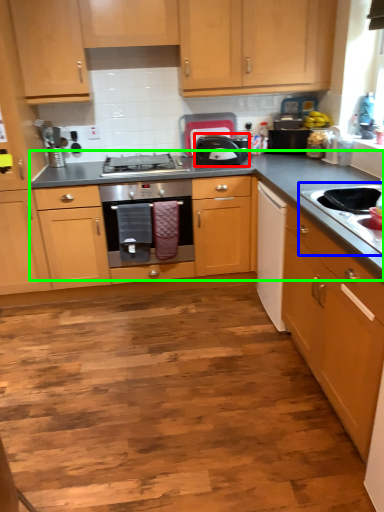
Question: Estimate the real-world distances between objects in this image. Which object is closer to kitchen appliance (highlighted by a red box), sink (highlighted by a blue box) or countertop (highlighted by a green box)?

Choices:
 (A) sink
 (B) countertop

Answer: (B)